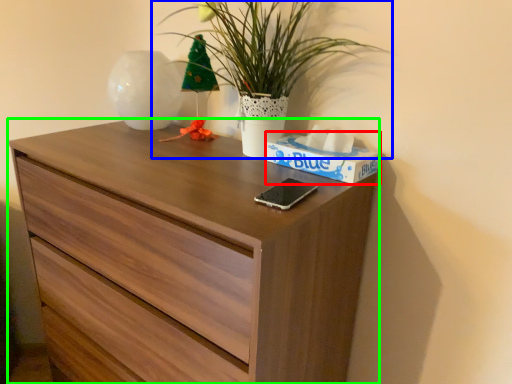
Question: Considering the real-world distances, which object is farthest from box (highlighted by a red box)? houseplant (highlighted by a blue box) or chest of drawers (highlighted by a green box)?

Choices:
 (A) houseplant
 (B) chest of drawers

Answer: (B)